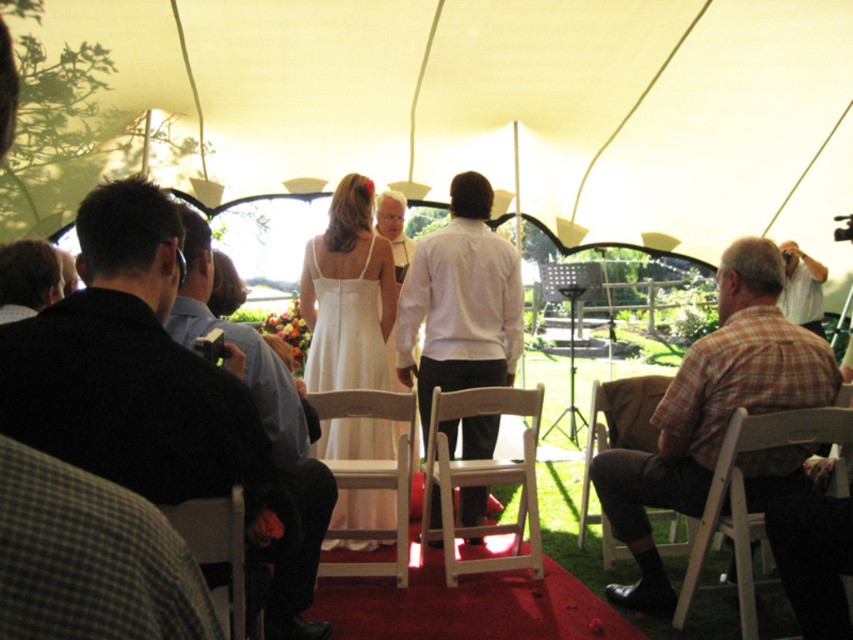
Which is below, dark blue shirt at center or wooden chair at lower left?

wooden chair at lower left is below.

Who is more forward, (288, 630) or (236, 547)?

Point (236, 547) is in front.

Based on the photo, measure the distance between point [264,618] and camera.

The distance of point [264,618] from camera is 3.02 meters.

Find the location of `dark blue shirt at center`. dark blue shirt at center is located at coordinates (268, 438).

Which is behind, point (442, 100) or point (0, 264)?

The point (442, 100) is behind.

Which of these two, white fabric canopy at center or black shirt at left, stands shorter?

black shirt at left is shorter.

Does point (587, 156) come closer to viewer compared to point (7, 248)?

No, it is behind (7, 248).

Image resolution: width=853 pixels, height=640 pixels. I want to click on white fabric canopy at center, so click(451, 109).

Does black sweater at left have a lesser height compared to white wood chair at lower right?

In fact, black sweater at left may be taller than white wood chair at lower right.

Who is positioned more to the left, black sweater at left or white wood chair at lower right?

black sweater at left

Find the location of `black sweater at left`. black sweater at left is located at coordinates (132, 369).

Image resolution: width=853 pixels, height=640 pixels. I want to click on black sweater at left, so click(x=132, y=369).